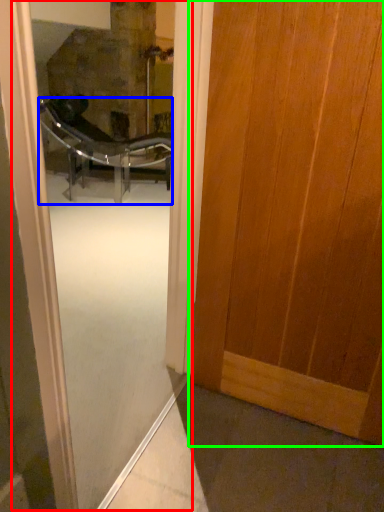
Question: Which object is the farthest from screen door (highlighted by a red box)? Choose among these: chair (highlighted by a blue box) or door (highlighted by a green box).

Choices:
 (A) chair
 (B) door

Answer: (B)